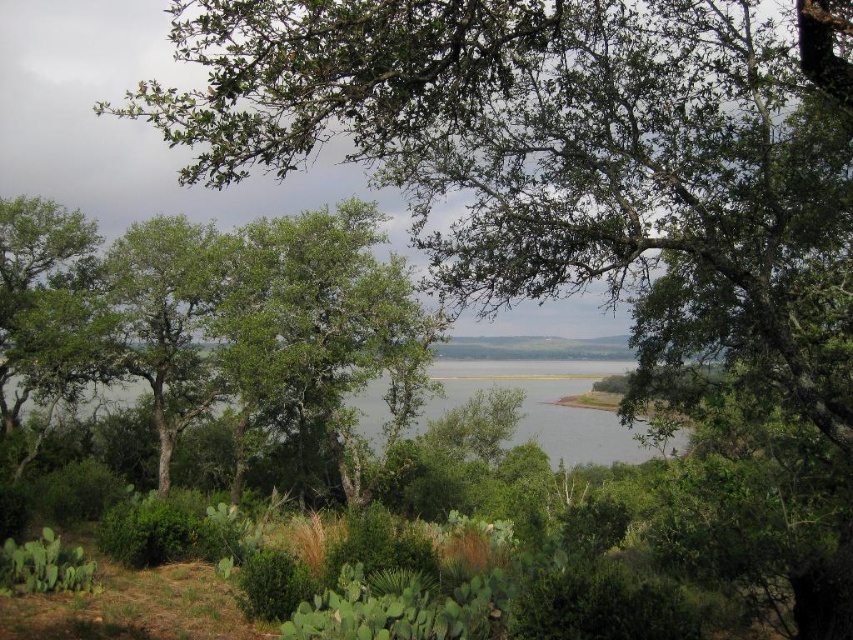
In the scene shown: Who is taller, green leafy tree at center or green leafy water at center?

Standing taller between the two is green leafy tree at center.

Is point (28, 337) positioned before point (479, 372)?

Yes, it is in front of point (479, 372).

Is point (209, 244) less distant than point (523, 417)?

Yes, it is in front of point (523, 417).

This screenshot has width=853, height=640. Identify the location of green leafy tree at center. (212, 316).